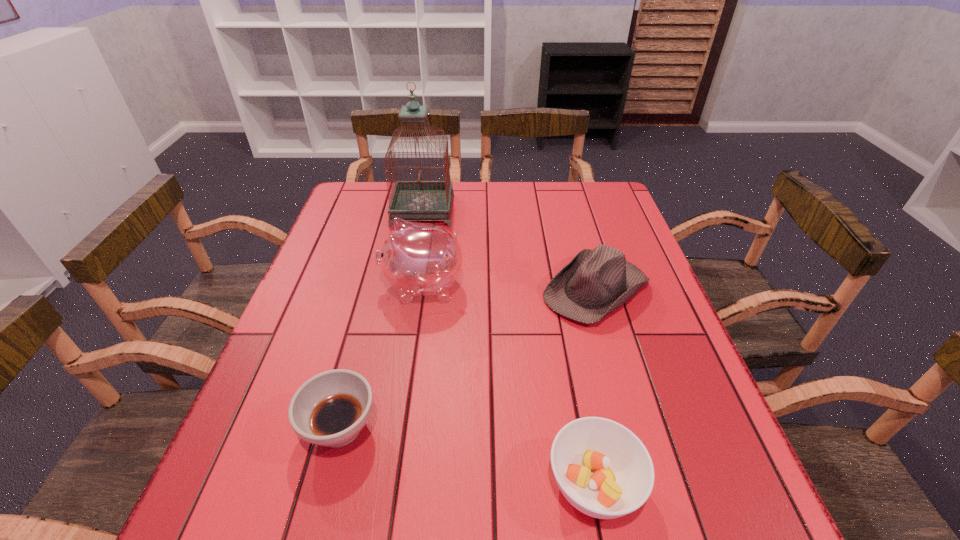
Find the location of `empty space between the right soup bowl and the birdcage`. empty space between the right soup bowl and the birdcage is located at coordinates (508, 347).

Identify the location of free space between the left soup bowl and the fedora. (468, 359).

You are a GUI agent. You are given a task and a screenshot of the screen. Output one action in this format:
    pyautogui.click(x=<x>, y=<y>)
    Task: Click on the free area in between the left soup bowl and the third tallest object
    The width and height of the screenshot is (960, 540).
    Given the screenshot: What is the action you would take?
    pyautogui.click(x=468, y=359)

I want to click on object that stands as the closest to the tallest object, so click(418, 259).

I want to click on object that ranks as the third closest to the birdcage, so click(x=330, y=409).

Identify the location of free point that satisfies the following two spatial constraints: 1. on the front facing side of the right soup bowl; 2. on the right side of the piggy bank. The image size is (960, 540). (394, 484).

I want to click on free space that satisfies the following two spatial constraints: 1. on the back side of the third tallest object; 2. at the door of the birdcage, so click(572, 210).

Locate an element on the screen. vacant space that satisfies the following two spatial constraints: 1. at the door of the fedora; 2. on the left side of the tallest object is located at coordinates (409, 289).

Where is `free location that satisfies the following two spatial constraints: 1. at the door of the birdcage; 2. on the left side of the third tallest object`? free location that satisfies the following two spatial constraints: 1. at the door of the birdcage; 2. on the left side of the third tallest object is located at coordinates (409, 289).

Where is `vacant region that satisfies the following two spatial constraints: 1. on the back side of the third tallest object; 2. on the left side of the left soup bowl`? vacant region that satisfies the following two spatial constraints: 1. on the back side of the third tallest object; 2. on the left side of the left soup bowl is located at coordinates (376, 289).